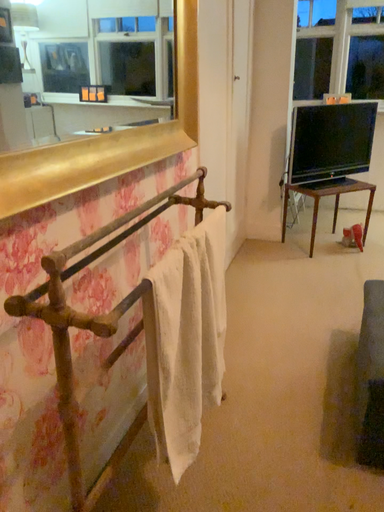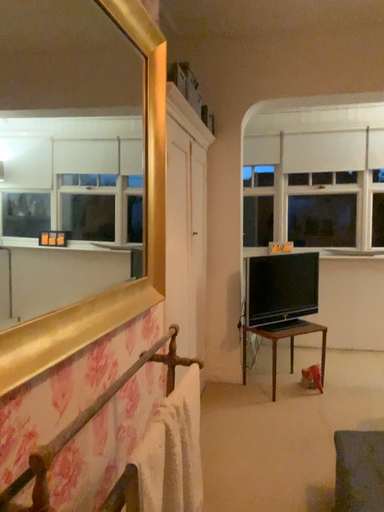
Question: Which way did the camera rotate in the video?

Choices:
 (A) rotated left
 (B) rotated right

Answer: (B)